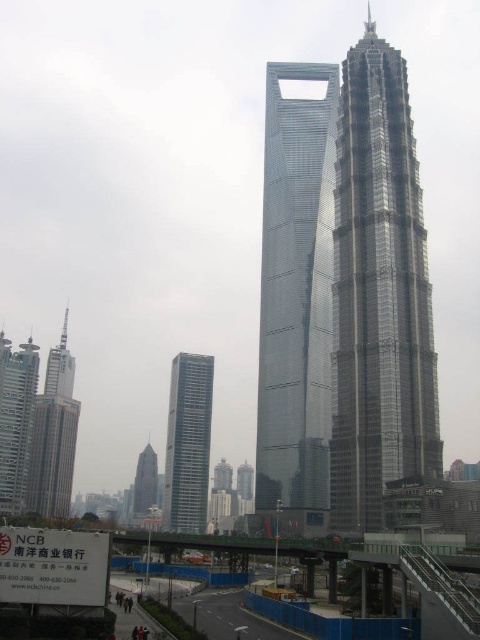
Looking at this image, based on the provided scene description, where is the gold reflective tower at left located in terms of its 2D coordinates?

The gold reflective tower at left is located at the 2D coordinates of point (54, 435).

You are a drone operator planning to fly a drone from the smooth asphalt highway at lower center to the sleek silver skyscraper at center. According to the image, is the highway closer to you or farther away compared to the skyscraper?

The smooth asphalt highway at lower center is behind the sleek silver skyscraper at center, so the highway is farther away from you compared to the skyscraper.

You are an architect analyzing the Shanghai World Financial Center. You observe the shiny glass skyscraper at center and the sleek silver skyscraper at center in the image. Which of these two skyscrapers is positioned higher in the scene?

The shiny glass skyscraper at center is located above the sleek silver skyscraper at center, so it is positioned higher in the scene.